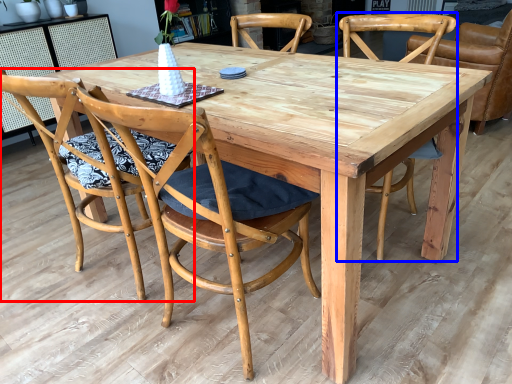
Question: Among these objects, which one is farthest to the camera, chair (highlighted by a red box) or chair (highlighted by a blue box)?

Choices:
 (A) chair
 (B) chair

Answer: (B)